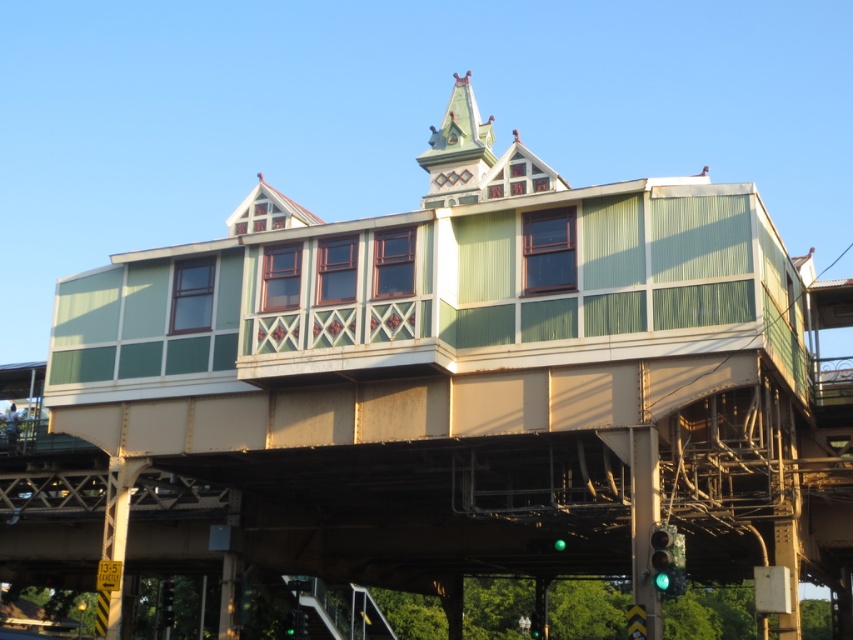
Looking at this image, you are standing at the base of the multi level structure and looking up. You notice two points marked on the building. The first point is at coordinate point (656, 556) and the second point is at coordinate point (544, 611). Which of these two points is closer to you?

Point (656, 556) is in front of point (544, 611), so the first point is closer to you.